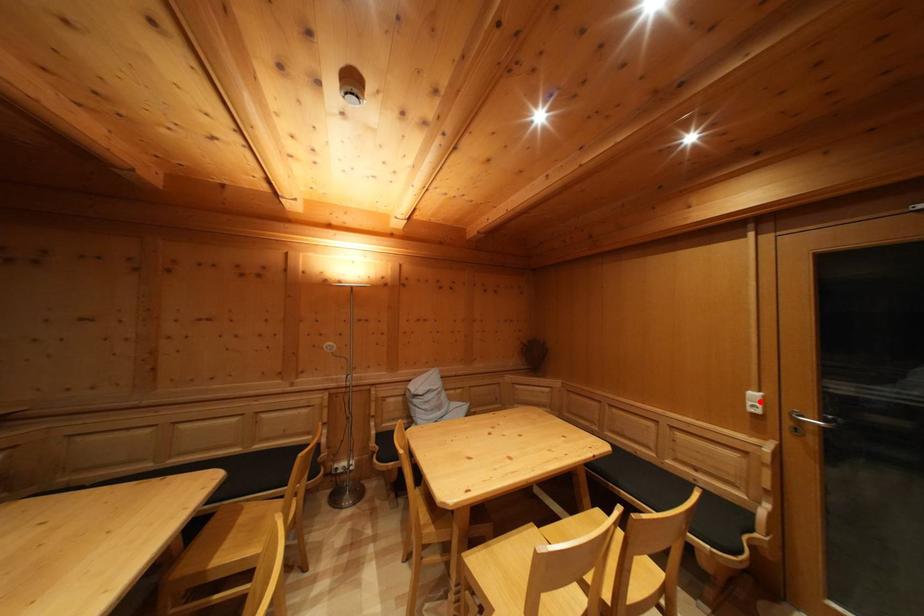
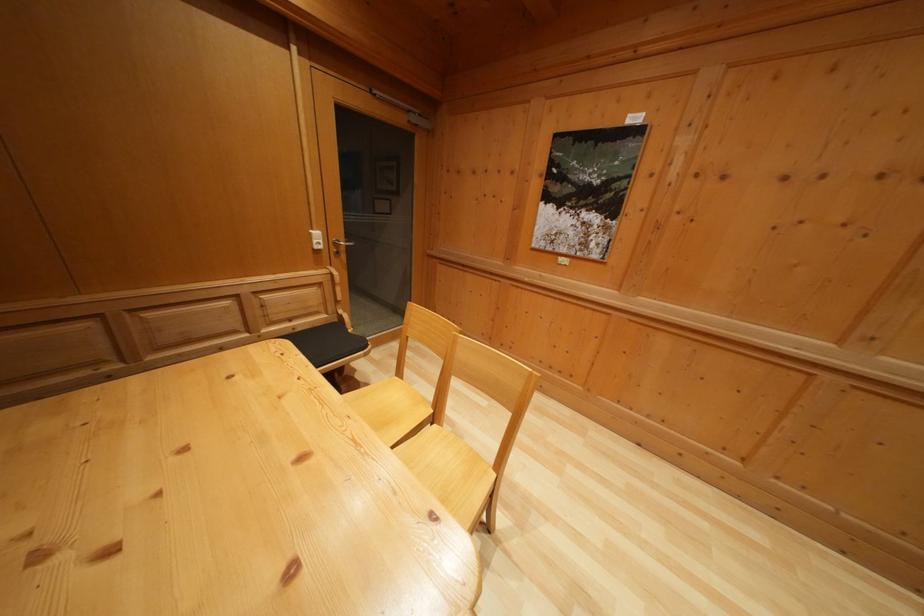
Where in the second image is the point corresponding to the highlighted location from the first image?

(322, 240)